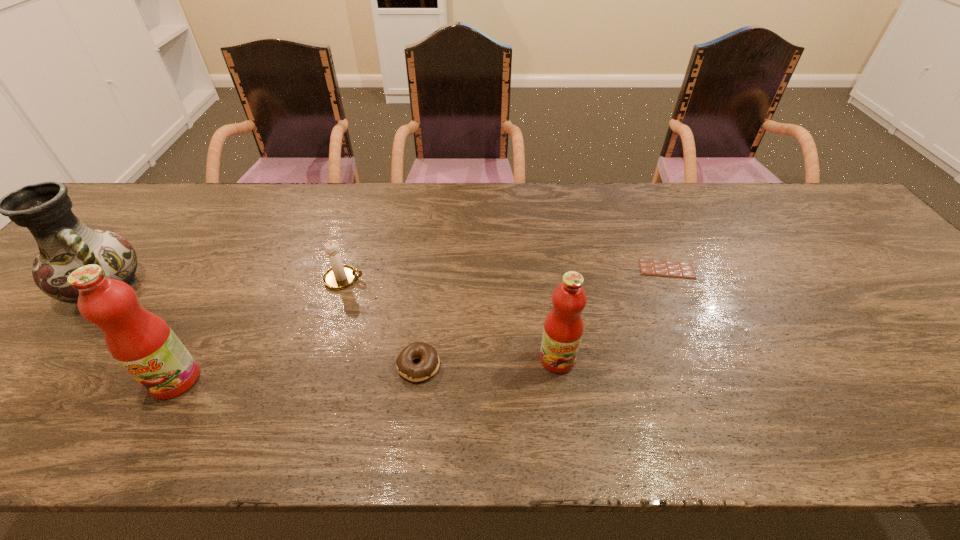
Please show where to add a fruit juice on the right while keeping spacing even. Please provide its 2D coordinates. Your answer should be formatted as a tuple, i.e. [(x, y)], where the tuple contains the x and y coordinates of a point satisfying the conditions above.

[(912, 340)]